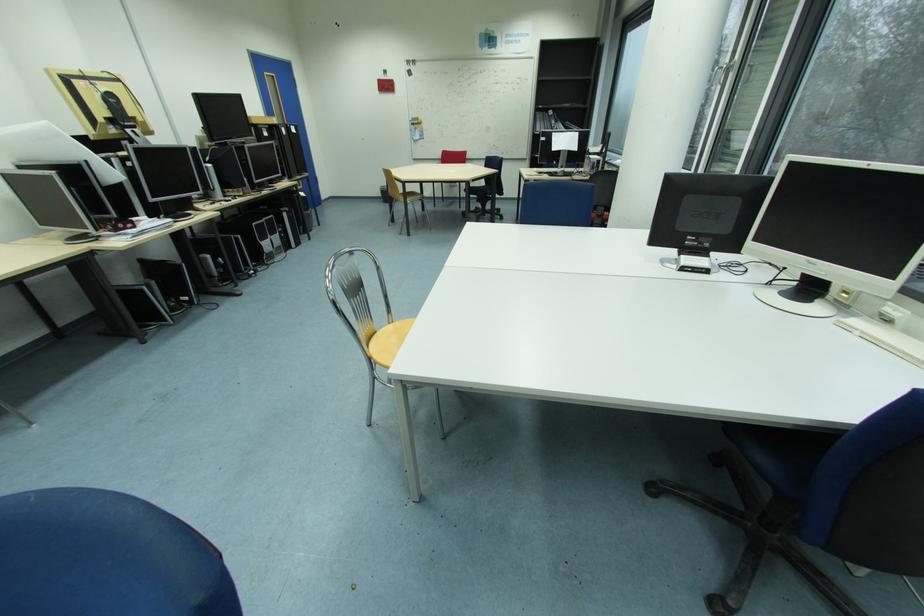
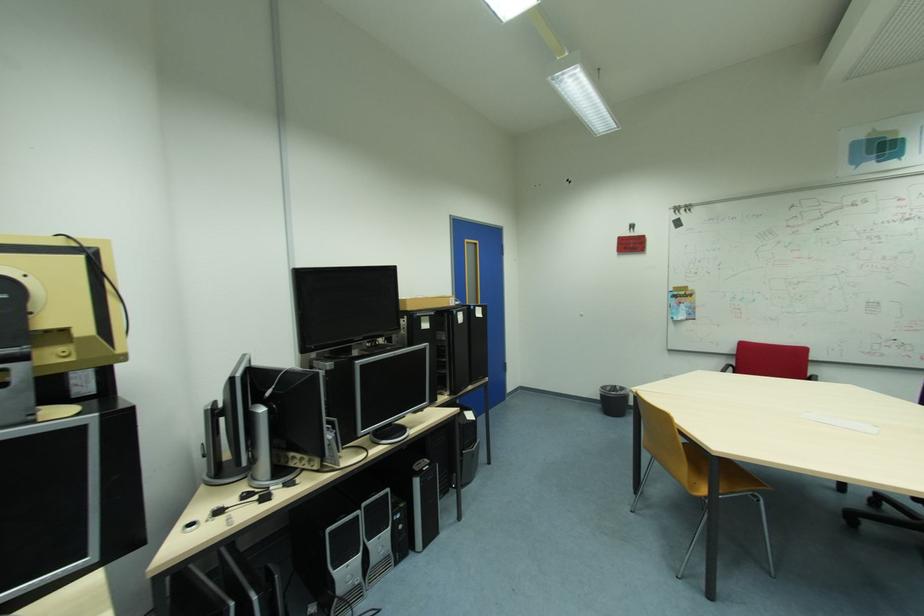
In the second image, find the point that corresponds to point 274,75 in the first image.

(473, 241)